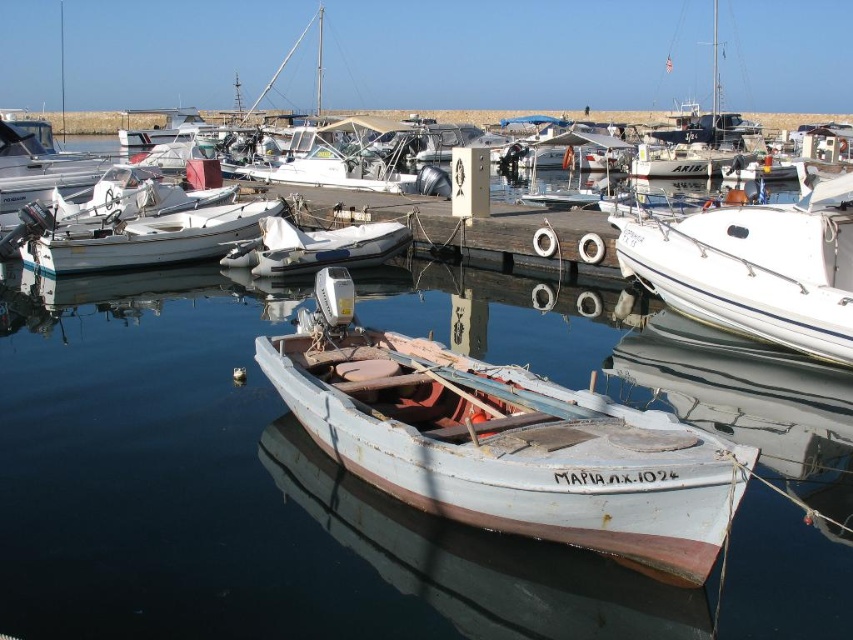
Question: Does white glossy boat at right come behind white matte boat at center?

Choices:
 (A) no
 (B) yes

Answer: (A)

Question: Which of the following is the farthest from the observer?

Choices:
 (A) (358, 440)
 (B) (27, 241)
 (C) (299, 269)
 (D) (637, 275)

Answer: (B)

Question: Which object is positioned farthest from the white rubber dinghy at center?

Choices:
 (A) white glossy boat at right
 (B) white weathered boat at center
 (C) white matte boat at center

Answer: (B)

Question: Considering the relative positions of white weathered boat at center and white glossy boat at right in the image provided, where is white weathered boat at center located with respect to white glossy boat at right?

Choices:
 (A) right
 (B) left

Answer: (B)

Question: Can you confirm if white matte boat at center is wider than white rubber dinghy at center?

Choices:
 (A) no
 (B) yes

Answer: (B)

Question: Which of the following is the closest to the observer?

Choices:
 (A) (724, 260)
 (B) (345, 230)
 (C) (242, 221)
 (D) (561, 531)

Answer: (D)